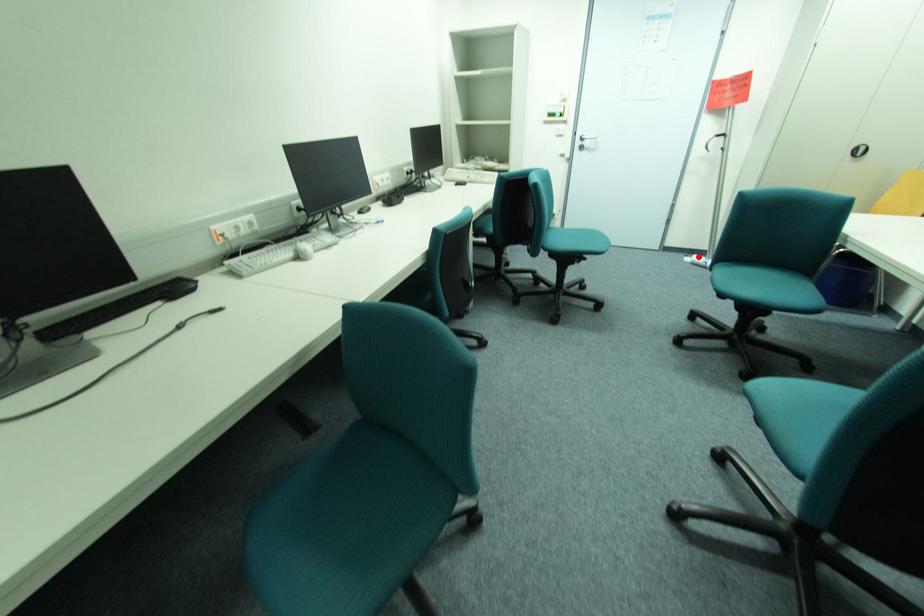
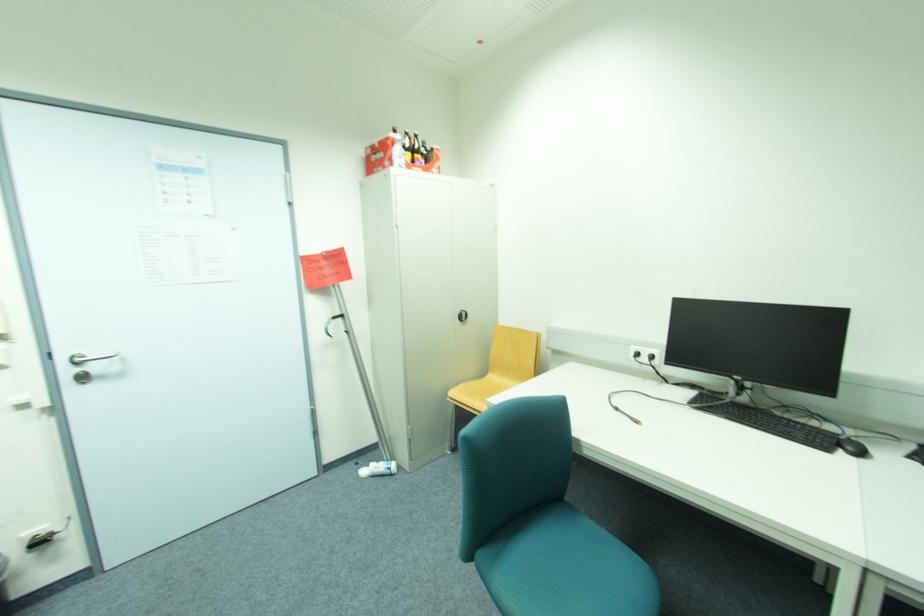
Where in the second image is the point corresponding to the highlighted location from the first image?

(373, 468)